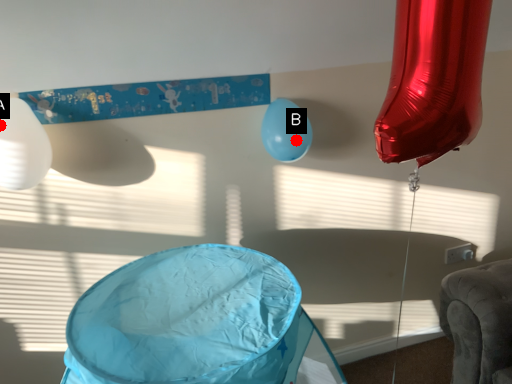
Question: Two points are circled on the image, labeled by A and B beside each circle. Which point is closer to the camera?

Choices:
 (A) A is closer
 (B) B is closer

Answer: (A)